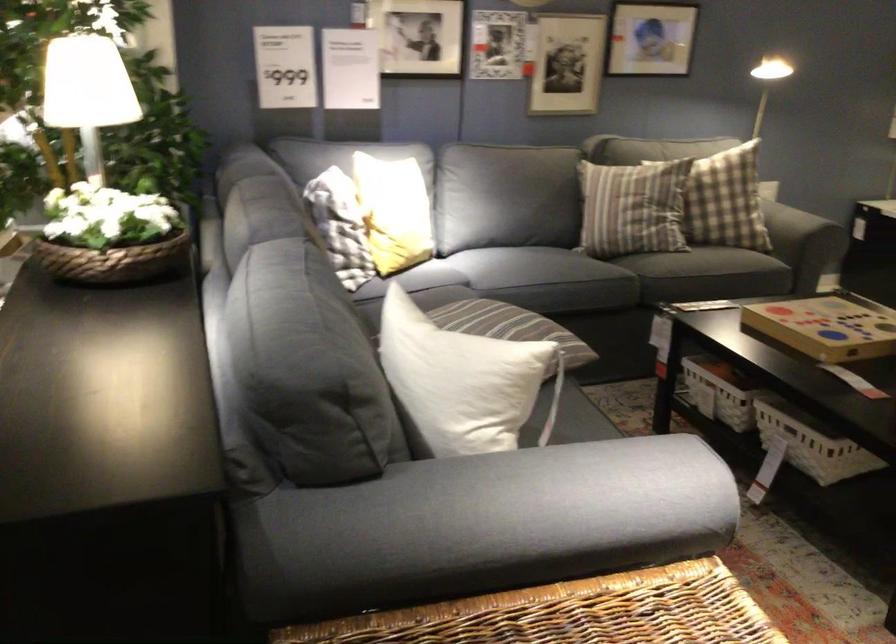
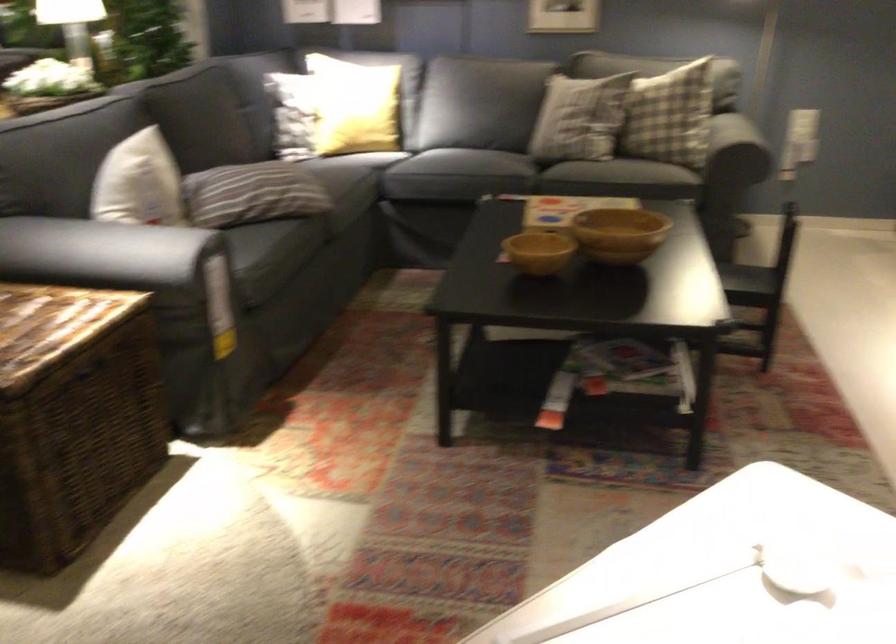
Question: I am providing you with two images of the same scene from different viewpoints. Please identify which objects are invisible in image2.

Choices:
 (A) striped throw pillow
 (B) small wooden bowl
 (C) outlet test button
 (D) black chair sitting surface

Answer: (A)